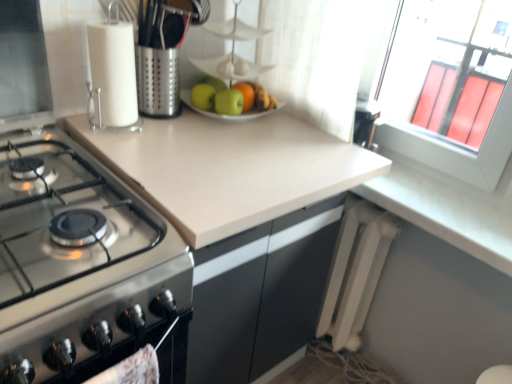
Locate an element on the screen. Image resolution: width=512 pixels, height=384 pixels. blank space to the left of green matte apple at center, which is the 1th apple from right to left is located at coordinates (174, 117).